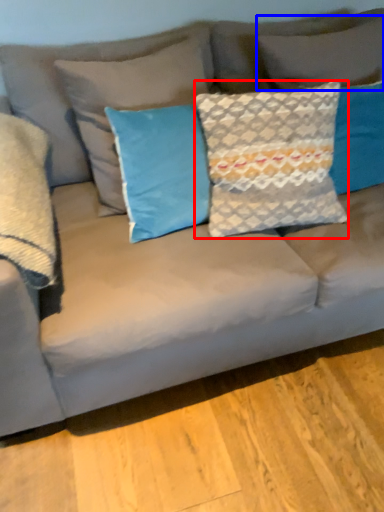
Question: Among these objects, which one is nearest to the camera, pillow (highlighted by a red box) or pillow (highlighted by a blue box)?

Choices:
 (A) pillow
 (B) pillow

Answer: (A)